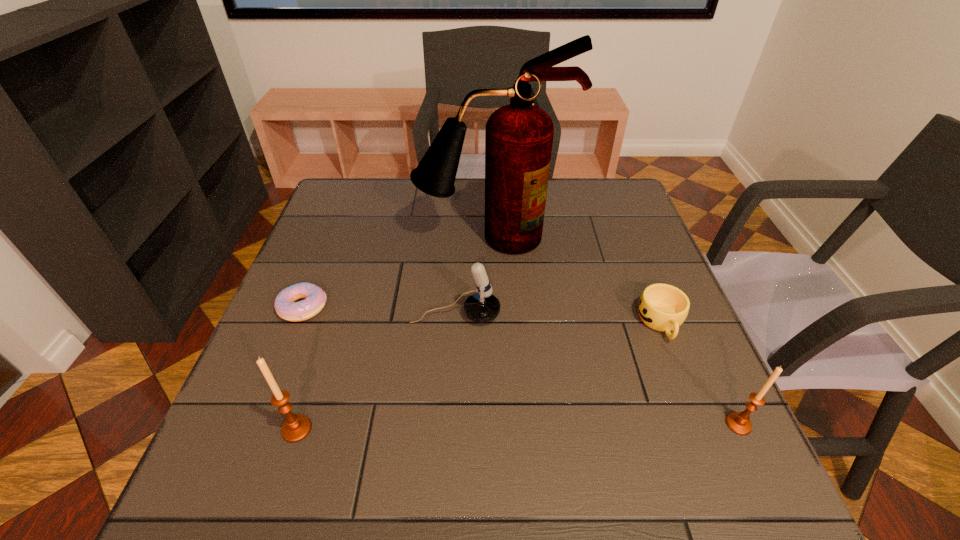
This screenshot has width=960, height=540. In order to click on vacant space located at the nozzle of the tallest object in this screenshot , I will do `click(494, 313)`.

You are a GUI agent. You are given a task and a screenshot of the screen. Output one action in this format:
    pyautogui.click(x=<x>, y=<y>)
    Task: Click on the free point located on the front of the shortest object
    
    Given the screenshot: What is the action you would take?
    pyautogui.click(x=274, y=383)

Where is `vacant region located 0.250m on the right of the microphone`? The height and width of the screenshot is (540, 960). vacant region located 0.250m on the right of the microphone is located at coordinates (610, 315).

The height and width of the screenshot is (540, 960). What are the coordinates of `vacant space situated on the left of the cup` in the screenshot? It's located at (543, 323).

Image resolution: width=960 pixels, height=540 pixels. I want to click on object located in the far edge section of the desktop, so click(x=518, y=137).

In order to click on candle_holder positioned at the left edge in this screenshot , I will do `click(296, 427)`.

Find the location of a particular element. Image resolution: width=960 pixels, height=540 pixels. doughnut that is at the left edge is located at coordinates (286, 307).

Find the location of a particular element. This screenshot has height=540, width=960. candle_holder that is at the right edge is located at coordinates [739, 423].

Where is `cup present at the right edge`? Image resolution: width=960 pixels, height=540 pixels. cup present at the right edge is located at coordinates (662, 307).

Identify the location of object that is at the near left corner. The width and height of the screenshot is (960, 540). (296, 427).